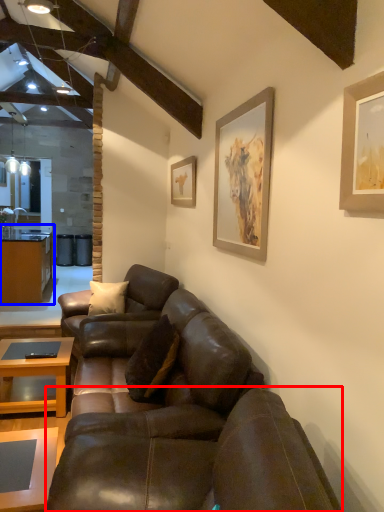
Question: Which object appears closest to the camera in this image, studio couch (highlighted by a red box) or cabinetry (highlighted by a blue box)?

Choices:
 (A) studio couch
 (B) cabinetry

Answer: (A)